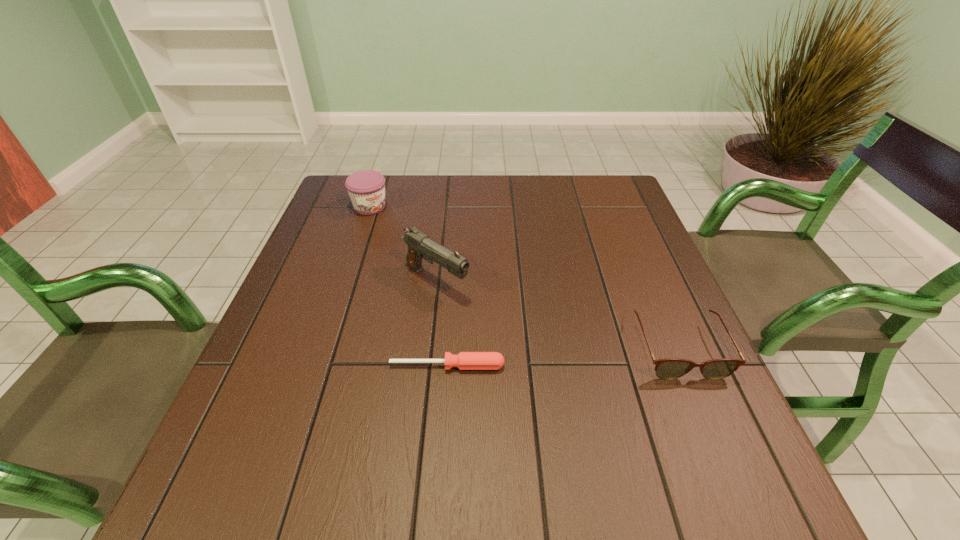
Where is `free spot on the desktop that is between the shortest object and the spectacles and is positioned on the front label of the jam`? The height and width of the screenshot is (540, 960). free spot on the desktop that is between the shortest object and the spectacles and is positioned on the front label of the jam is located at coordinates (558, 358).

Locate an element on the screen. The width and height of the screenshot is (960, 540). free space on the desktop that is between the shortest object and the spectacles and is positioned in the direction the second farthest object is aimed is located at coordinates (554, 358).